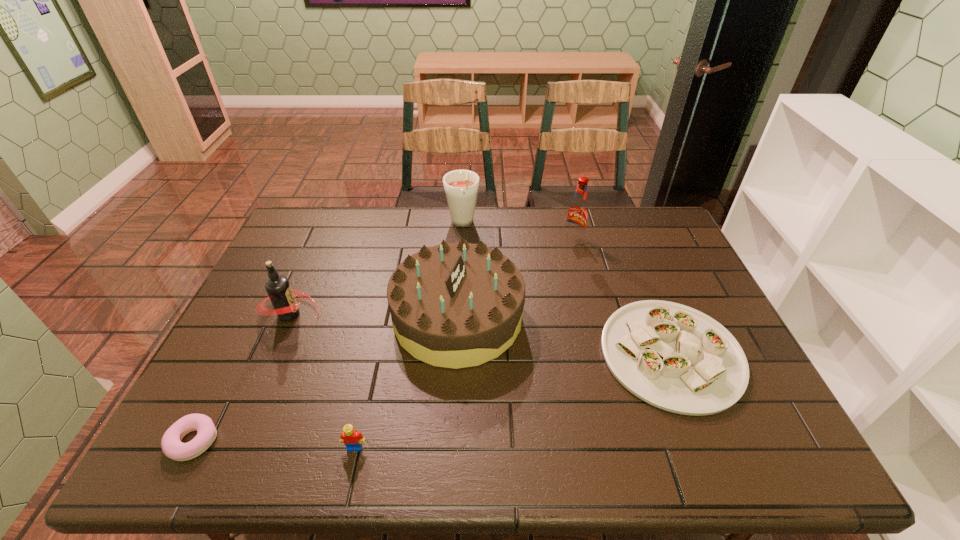
Where is `the rightmost root beer`? This screenshot has width=960, height=540. the rightmost root beer is located at coordinates (577, 214).

The width and height of the screenshot is (960, 540). In order to click on the second root beer from left to right in this screenshot , I will do `click(461, 186)`.

Locate an element on the screen. The height and width of the screenshot is (540, 960). the nearest root beer is located at coordinates (282, 296).

The height and width of the screenshot is (540, 960). I want to click on the shortest root beer, so click(x=282, y=296).

Image resolution: width=960 pixels, height=540 pixels. What are the coordinates of `birthday cake` in the screenshot? It's located at (455, 305).

Image resolution: width=960 pixels, height=540 pixels. In order to click on Lego in this screenshot , I will do `click(351, 438)`.

At what (x,y) coordinates should I click in order to perform the action: click on platter. Please return your answer as a coordinate pair (x, y). Looking at the image, I should click on (676, 358).

Identify the location of pastry. This screenshot has width=960, height=540. (172, 447).

Locate an element on the screen. Image resolution: width=960 pixels, height=540 pixels. vacant region located on the front of the rightmost root beer is located at coordinates (580, 266).

You are a GUI agent. You are given a task and a screenshot of the screen. Output one action in this format:
    pyautogui.click(x=<x>, y=<y>)
    Task: Click on the blank area located on the drink side of the second root beer from left to right
    
    Given the screenshot: What is the action you would take?
    pyautogui.click(x=457, y=323)